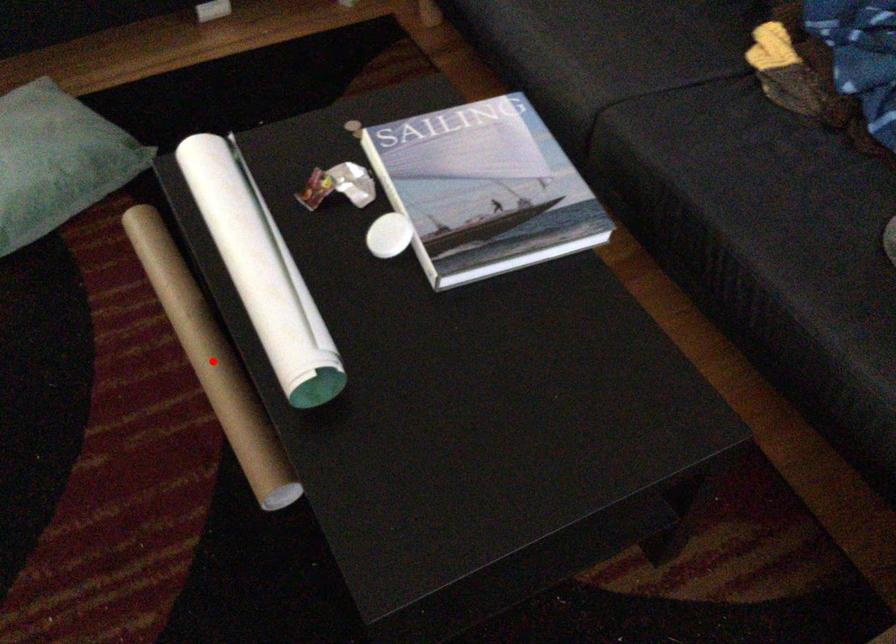
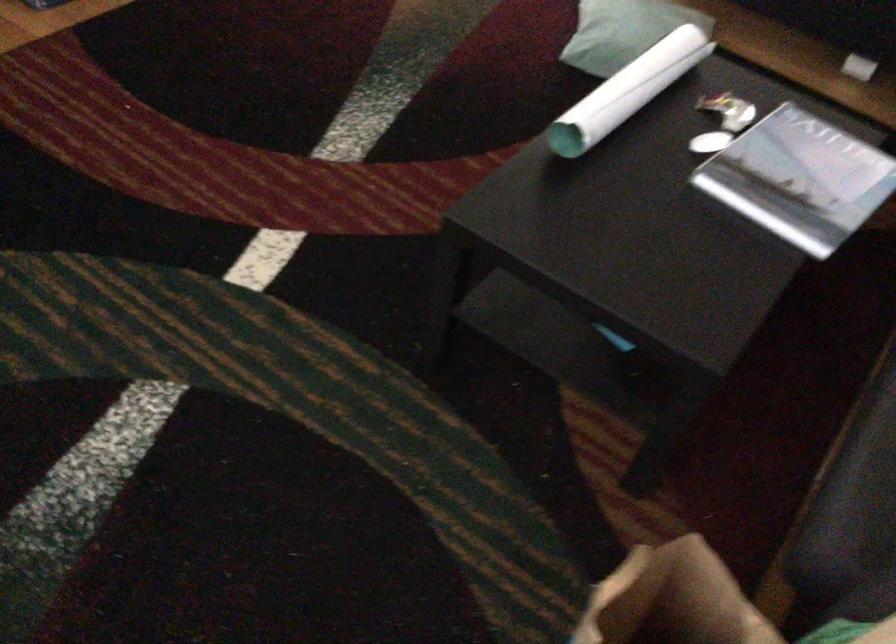
Question: I am providing you with two images of the same scene from different viewpoints. A red point is marked on the first image. At the location where the point appears in image 1, is it still visible in image 2?

Choices:
 (A) Yes
 (B) No

Answer: (B)